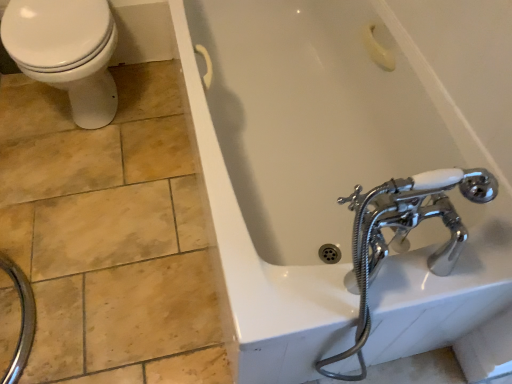
This screenshot has width=512, height=384. Find the location of `vacant area that is in front of white glossy toilet at upper left`. vacant area that is in front of white glossy toilet at upper left is located at coordinates (88, 199).